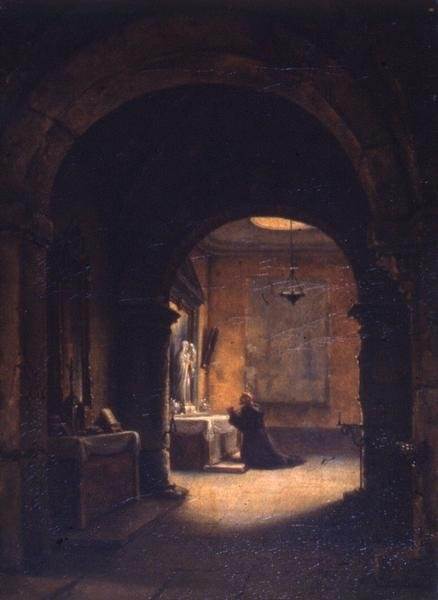
I want to click on wall, so [x=216, y=288].